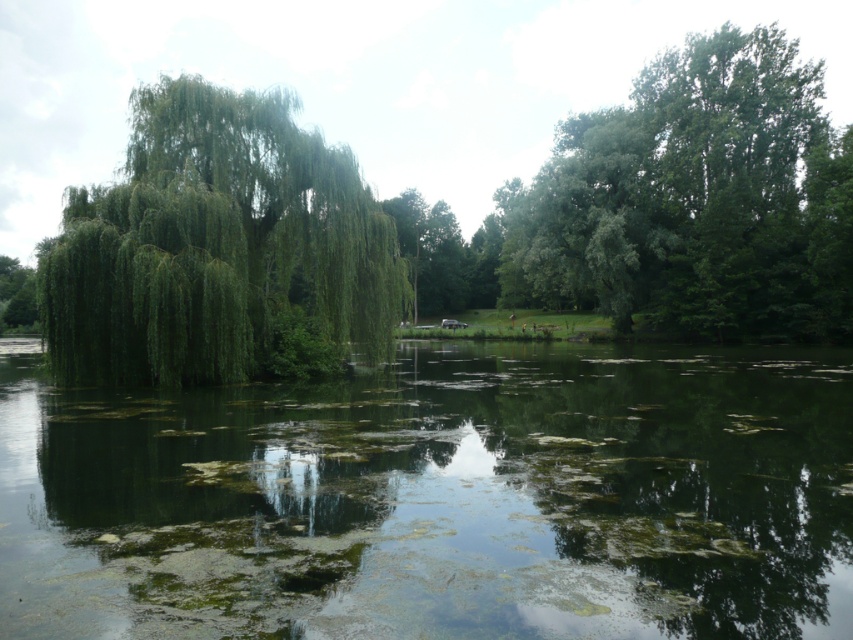
Can you confirm if green algae-covered water at center is positioned above green leafy willow at left?

No.

Which of these two, green algae-covered water at center or green leafy willow at left, stands shorter?

green algae-covered water at center

Which is behind, point (693, 400) or point (149, 102)?

The point (149, 102) is more distant.

This screenshot has width=853, height=640. In order to click on green algae-covered water at center in this screenshot , I will do `click(438, 499)`.